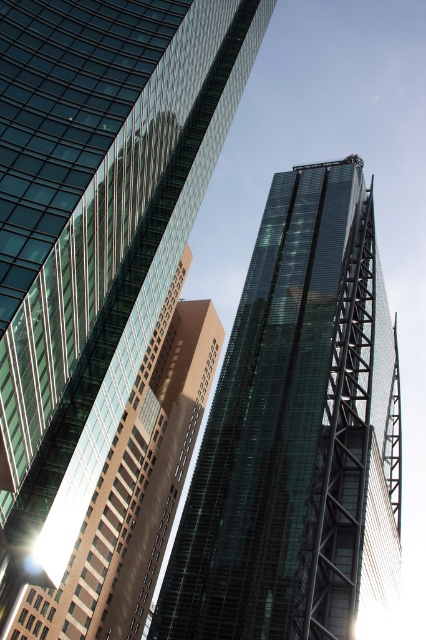
Is transparent glass skyscraper at center to the left of green glass tower at center from the viewer's perspective?

Yes, transparent glass skyscraper at center is to the left of green glass tower at center.

Can you confirm if transparent glass skyscraper at center is bigger than green glass tower at center?

No.

Between point (60, 500) and point (262, 257), which one is positioned behind?

The point (262, 257) is more distant.

Where is `transparent glass skyscraper at center`? The width and height of the screenshot is (426, 640). transparent glass skyscraper at center is located at coordinates (97, 234).